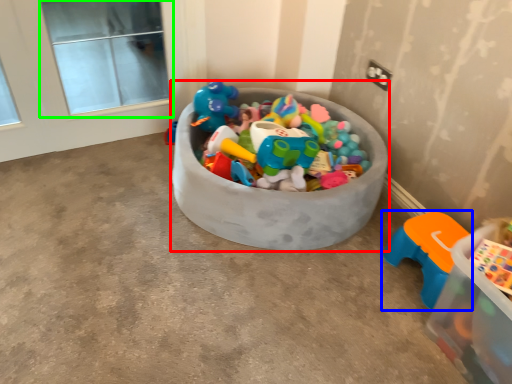
Question: Based on their relative distances, which object is nearer to storage box (highlighted by a red box)? Choose from toy (highlighted by a blue box) and window screen (highlighted by a green box).

Choices:
 (A) toy
 (B) window screen

Answer: (A)